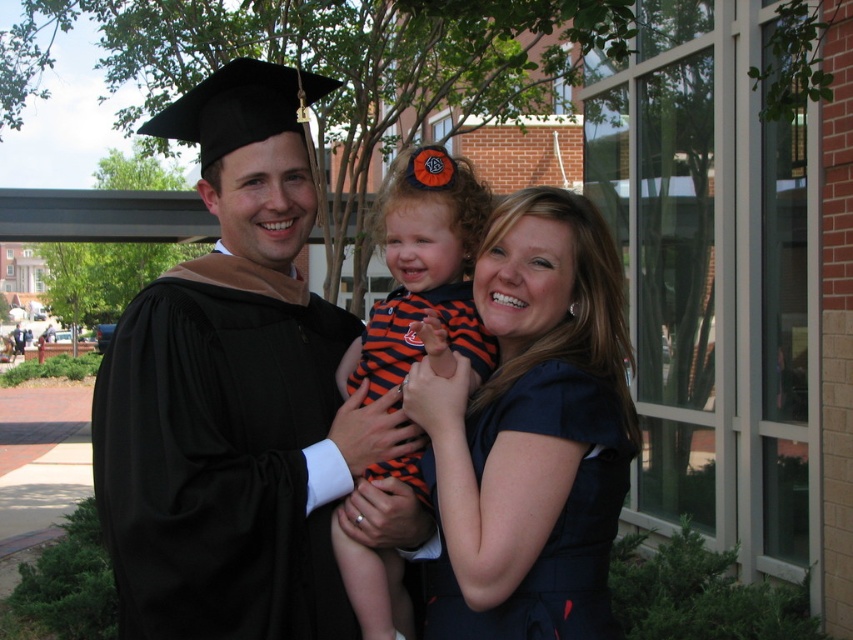
You are attending a graduation ceremony and notice two dresses in the crowd. The first is a navy blue dress at center, and the second is a striped fabric dress at center. From your perspective, which dress appears lower in the image?

The navy blue dress at center is positioned under the striped fabric dress at center, so the navy blue dress at center appears lower.

You are a photographer at a graduation ceremony and need to ensure all attendees are visible in a group photo. Given that the navy blue dress at center and the striped fabric dress at center are in the frame, which dress should you focus on to capture more of the subject wearing it?

The striped fabric dress at center occupies more space in the frame than the navy blue dress at center, so focusing on it will capture more of the subject wearing it.